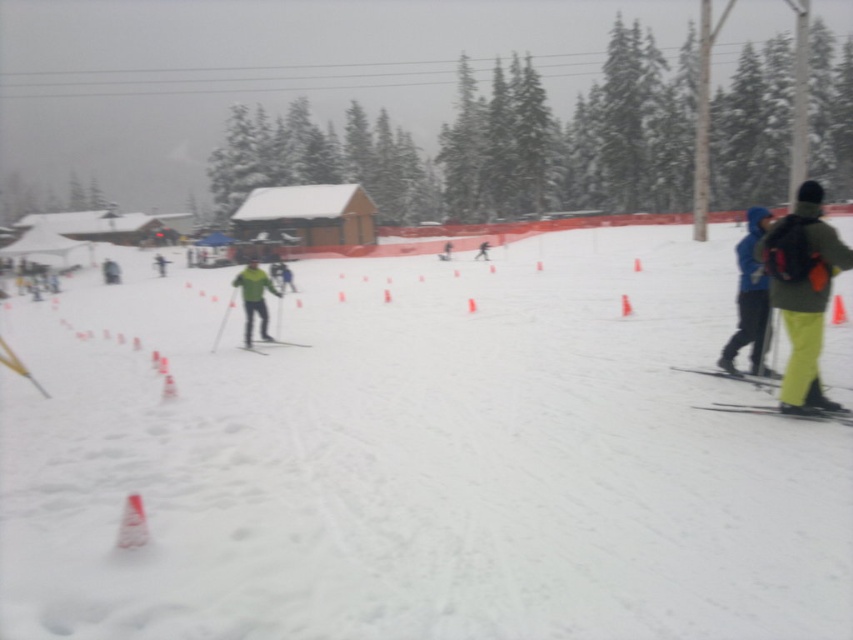
You are planning to take a photo of the white snow ski slope at center and the green fabric jacket at right. Which object should you focus on first if you want to capture both in the frame without moving the camera?

You should focus on the white snow ski slope at center first because it is larger than the green fabric jacket at right, ensuring it fits properly in the frame.

You are a skier standing at the top of the slope. You see the white snow ski slope at center and the green fabric jacket at right. Which object is closer to you?

The white snow ski slope at center is closer to you because it is in front of the green fabric jacket at right.

You are a ski instructor assessing equipment for two students. You have a yellow matte ski at lower right and a matte green ski at center. Which ski is narrower?

The yellow matte ski at lower right is narrower than the matte green ski at center.